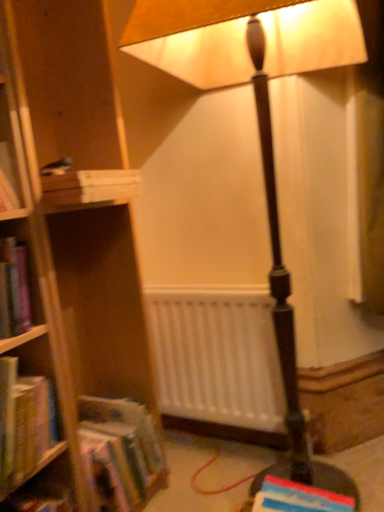
In order to face matte brown lamp at center, should I rotate leftwards or rightwards?

Turn right approximately 10.682 degrees to face it.

Describe the element at coordinates (217, 356) in the screenshot. I see `white matte radiator at center` at that location.

In order to face hardcover book at lower right, which is counted as the 1th book, starting from the bottom, should I rotate leftwards or rightwards?

To align with it, rotate right about 14.525°.

Find the location of a particular element. This screenshot has width=384, height=512. wooden crate at left, which appears as the 1th book when viewed from the top is located at coordinates (90, 187).

From the picture: Does hardcover book at lower right, the fourth book positioned from the top, appear on the right side of matte brown lamp at center?

Correct, you'll find hardcover book at lower right, the fourth book positioned from the top, to the right of matte brown lamp at center.

Is hardcover book at lower right, the fourth book positioned from the top, completely or partially outside of matte brown lamp at center?

No.

Can you confirm if hardcover book at lower right, which is counted as the 1th book, starting from the bottom, is bigger than matte brown lamp at center?

Actually, hardcover book at lower right, which is counted as the 1th book, starting from the bottom, might be smaller than matte brown lamp at center.

Considering the positions of point (266, 501) and point (300, 476), is point (266, 501) closer or farther from the camera than point (300, 476)?

Point (266, 501) is closer to the camera than point (300, 476).

Which object is positioned more to the right, white matte radiator at center or hardcover book at lower right, which is counted as the 1th book, starting from the bottom?

hardcover book at lower right, which is counted as the 1th book, starting from the bottom, is more to the right.

Locate an element on the screen. The image size is (384, 512). radiator above the hardcover book at lower right, the fourth book positioned from the top (from the image's perspective) is located at coordinates (217, 356).

Is white matte radiator at center next to hardcover book at lower right, the fourth book positioned from the top, and touching it?

There is a gap between white matte radiator at center and hardcover book at lower right, the fourth book positioned from the top.

Based on the photo, from a real-world perspective, which is physically below, white matte radiator at center or hardcover book at lower right, the fourth book positioned from the top?

hardcover book at lower right, the fourth book positioned from the top, from a real-world perspective.

Is point (86, 411) positioned behind point (225, 76)?

No, it is in front of (225, 76).

Which object is closer to the camera taking this photo, hardcover book at lower left, arranged as the 3th book when viewed from the top, or matte brown lamp at center?

matte brown lamp at center is closer to the camera.

Based on the photo, considering the sizes of objects hardcover book at lower left, arranged as the 3th book when viewed from the top, and matte brown lamp at center in the image provided, who is wider, hardcover book at lower left, arranged as the 3th book when viewed from the top, or matte brown lamp at center?

matte brown lamp at center is wider.

Based on the photo, considering the sizes of objects hardcover book at lower left, which is the second book from bottom to top, and matte brown lamp at center in the image provided, who is taller, hardcover book at lower left, which is the second book from bottom to top, or matte brown lamp at center?

Standing taller between the two is matte brown lamp at center.

Would you say white matte radiator at center is a long distance from hardcover book at lower left, which is the second book from bottom to top?

They are positioned close to each other.

Which object is closer to the camera, white matte radiator at center or hardcover book at lower left, which is the second book from bottom to top?

Positioned in front is hardcover book at lower left, which is the second book from bottom to top.

Between white matte radiator at center and hardcover book at lower left, which is the second book from bottom to top, which one has larger width?

With larger width is hardcover book at lower left, which is the second book from bottom to top.

I want to click on the 1st book to the right of the hardcover book at left, the 3th book ordered from the bottom, starting your count from the anchor, so click(x=90, y=187).

Considering the sizes of wooden crate at left, which appears as the 1th book when viewed from the top, and hardcover book at left, the 3th book ordered from the bottom, in the image, is wooden crate at left, which appears as the 1th book when viewed from the top, taller or shorter than hardcover book at left, the 3th book ordered from the bottom,?

Considering their sizes, wooden crate at left, which appears as the 1th book when viewed from the top, has less height than hardcover book at left, the 3th book ordered from the bottom.

Is hardcover book at lower left, which is the second book from bottom to top, surrounded by hardcover book at lower right, the fourth book positioned from the top?

No, hardcover book at lower left, which is the second book from bottom to top, is not a part of hardcover book at lower right, the fourth book positioned from the top.

Is point (332, 495) behind point (101, 400)?

That is False.

I want to click on book below the hardcover book at lower left, which is the second book from bottom to top (from a real-world perspective), so click(298, 498).

In the image, is hardcover book at lower right, which is counted as the 1th book, starting from the bottom, on the left side or the right side of hardcover book at lower left, which is the second book from bottom to top?

Clearly, hardcover book at lower right, which is counted as the 1th book, starting from the bottom, is on the right of hardcover book at lower left, which is the second book from bottom to top, in the image.

From a real-world perspective, is wooden crate at left, which appears as the 1th book when viewed from the top, positioned above or below hardcover book at lower left, which is the second book from bottom to top?

In terms of real-world spatial position, wooden crate at left, which appears as the 1th book when viewed from the top, is above hardcover book at lower left, which is the second book from bottom to top.

Looking at the image, does wooden crate at left, which appears as the 1th book when viewed from the top, seem bigger or smaller compared to hardcover book at lower left, arranged as the 3th book when viewed from the top?

In the image, wooden crate at left, which appears as the 1th book when viewed from the top, appears to be smaller than hardcover book at lower left, arranged as the 3th book when viewed from the top.

Is wooden crate at left, which appears as the 1th book when viewed from the top, touching hardcover book at lower left, arranged as the 3th book when viewed from the top?

No, wooden crate at left, which appears as the 1th book when viewed from the top, is not touching hardcover book at lower left, arranged as the 3th book when viewed from the top.

Is wooden crate at left, acting as the 4th book starting from the bottom, positioned before hardcover book at lower left, arranged as the 3th book when viewed from the top?

Yes, wooden crate at left, acting as the 4th book starting from the bottom, is closer to the camera.

The image size is (384, 512). I want to click on the 3rd book directly beneath the matte brown lamp at center (from a real-world perspective), so click(298, 498).

Locate an element on the screen. the 2nd book below when counting from the white matte radiator at center (from the image's perspective) is located at coordinates (298, 498).

Which object lies further to the anchor point white matte radiator at center, wooden crate at left, which appears as the 1th book when viewed from the top, or hardcover book at left, the 2th book from the top?

The object further to white matte radiator at center is wooden crate at left, which appears as the 1th book when viewed from the top.

Looking at the image, which one is located further to hardcover book at left, the 2th book from the top, hardcover book at lower left, which is the second book from bottom to top, or matte brown lamp at center?

The object further to hardcover book at left, the 2th book from the top, is matte brown lamp at center.

Estimate the real-world distances between objects in this image. Which object is further from wooden crate at left, which appears as the 1th book when viewed from the top, white matte radiator at center or hardcover book at lower right, the fourth book positioned from the top?

Based on the image, hardcover book at lower right, the fourth book positioned from the top, appears to be further to wooden crate at left, which appears as the 1th book when viewed from the top.

From the image, which object appears to be nearer to white matte radiator at center, hardcover book at lower left, arranged as the 3th book when viewed from the top, or hardcover book at lower right, the fourth book positioned from the top?

A: hardcover book at lower left, arranged as the 3th book when viewed from the top, is closer to white matte radiator at center.

Which object lies further to the anchor point hardcover book at lower right, the fourth book positioned from the top, hardcover book at lower left, which is the second book from bottom to top, or hardcover book at left, the 2th book from the top?

hardcover book at left, the 2th book from the top, lies further to hardcover book at lower right, the fourth book positioned from the top, than the other object.

Looking at the image, which one is located closer to wooden crate at left, acting as the 4th book starting from the bottom, hardcover book at left, the 3th book ordered from the bottom, or matte brown lamp at center?

matte brown lamp at center is closer to wooden crate at left, acting as the 4th book starting from the bottom.

Based on their spatial positions, is hardcover book at lower left, which is the second book from bottom to top, or hardcover book at left, the 2th book from the top, further from matte brown lamp at center?

hardcover book at lower left, which is the second book from bottom to top, is positioned further to the anchor matte brown lamp at center.

Estimate the real-world distances between objects in this image. Which object is closer to matte brown lamp at center, hardcover book at lower right, the fourth book positioned from the top, or hardcover book at left, the 3th book ordered from the bottom?

hardcover book at left, the 3th book ordered from the bottom, lies closer to matte brown lamp at center than the other object.

Find the location of a particular element. This screenshot has width=384, height=512. book between wooden crate at left, acting as the 4th book starting from the bottom, and hardcover book at lower left, arranged as the 3th book when viewed from the top, vertically is located at coordinates (24, 424).

Locate an element on the screen. This screenshot has height=512, width=384. lamp between hardcover book at left, the 3th book ordered from the bottom, and hardcover book at lower right, the fourth book positioned from the top, in the horizontal direction is located at coordinates (259, 131).

This screenshot has width=384, height=512. What are the coordinates of `radiator between matte brown lamp at center and hardcover book at lower left, which is the second book from bottom to top, in the up-down direction` in the screenshot? It's located at (217, 356).

Image resolution: width=384 pixels, height=512 pixels. In order to click on lamp that lies between wooden crate at left, acting as the 4th book starting from the bottom, and hardcover book at lower right, which is counted as the 1th book, starting from the bottom, from top to bottom in this screenshot , I will do `click(259, 131)`.